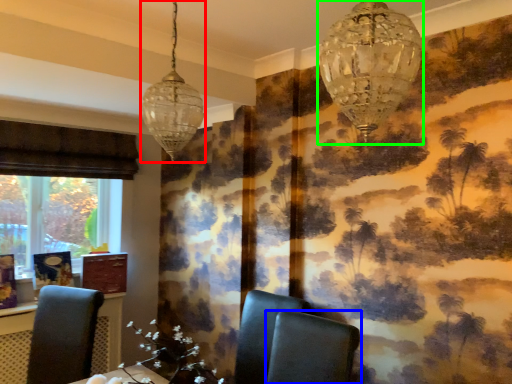
Question: Which is nearer to the lamp (highlighted by a red box)? chair (highlighted by a blue box) or lamp (highlighted by a green box).

Choices:
 (A) chair
 (B) lamp

Answer: (B)